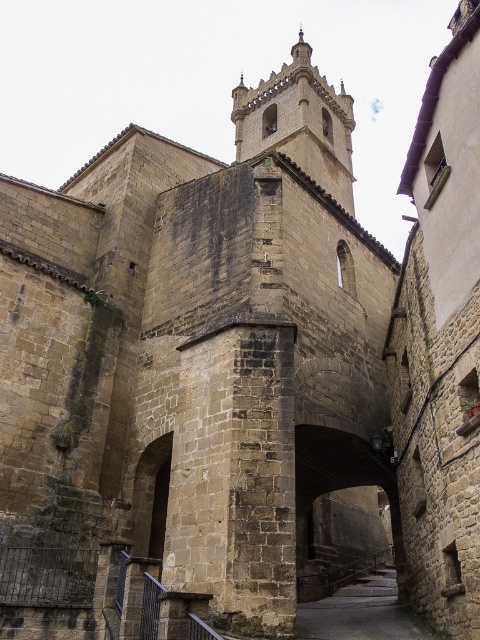
You are a tour guide leading a group through a historic site. You want to inform your group about the distance between the stone paved alley at center and the dark stone archway at center. What would you tell them?

The stone paved alley at center is 9.56 meters away from the dark stone archway at center.

You are standing in the historic stone building and want to exit through the main entrance, which is located at the end of the stone paved alley at center. To your left, you see the brown stone tower at center. Which direction should you walk to reach the alley and exit?

You should walk to the right of the brown stone tower at center because the stone paved alley at center is on its left side, so moving towards the alley would require heading in that direction.